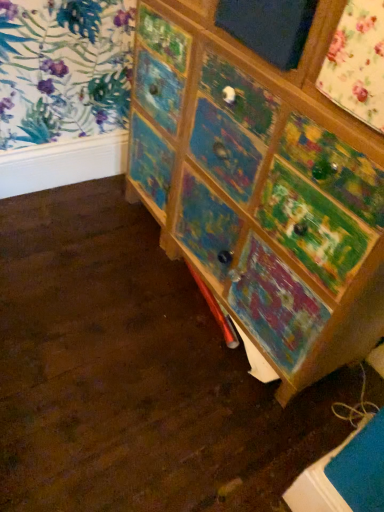
Question: Should I look upward or downward to see painted wood dresser at center?

Choices:
 (A) up
 (B) down

Answer: (A)